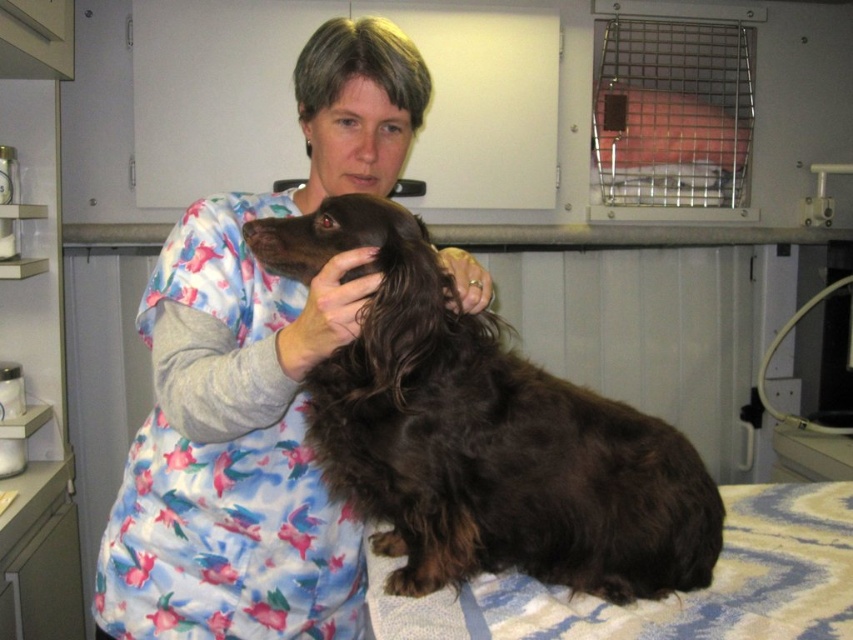
You are a veterinary assistant and need to place a medical chart on the table near the fluffy brown dog at center. The chart requires a space of 15 cm by 20 cm. Can you determine if there is enough space on the table next to the dog?

The position of the fluffy brown dog at center is at point (x=254, y=385). Since the exact dimensions of the table and available space are not provided, it is impossible to determine if there is enough space for the chart.

You are a veterinary assistant and need to prepare the right size of the dog bed for the fluffy brown dog at center and the brown furry dog at center. Which dog requires a larger bed based on their height?

The fluffy brown dog at center requires a larger bed since it has a greater height compared to the brown furry dog at center.

You are a veterinary assistant and need to place a small medical kit between the fluffy brown dog at center and the brown furry dog at center. Is there enough space to fit the kit, which is 15 centimeters long?

The distance between the fluffy brown dog at center and the brown furry dog at center is 17.34 centimeters. Since the medical kit is 15 centimeters long, there is sufficient space to place it between them.